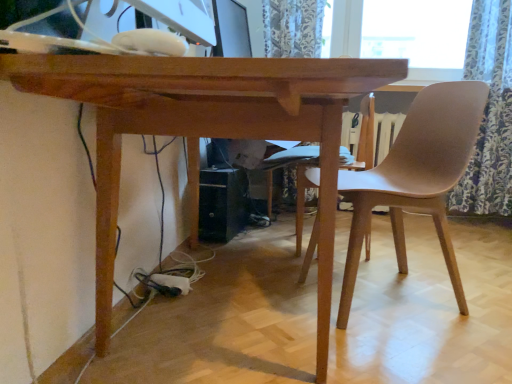
Question: From their relative heights in the image, would you say floral fabric curtain at right is taller or shorter than matte brown chair at right?

Choices:
 (A) short
 (B) tall

Answer: (B)

Question: Does point (510, 62) appear closer or farther from the camera than point (351, 299)?

Choices:
 (A) farther
 (B) closer

Answer: (A)

Question: Estimate the real-world distances between objects in this image. Which object is closer to the matte black monitor at upper center?

Choices:
 (A) wooden table at center
 (B) matte brown chair at right
 (C) white glossy monitor at upper center
 (D) floral fabric curtain at right

Answer: (B)

Question: Estimate the real-world distances between objects in this image. Which object is closer to the floral fabric curtain at right?

Choices:
 (A) wooden table at center
 (B) matte brown chair at right
 (C) matte black monitor at upper center
 (D) white glossy monitor at upper center

Answer: (B)